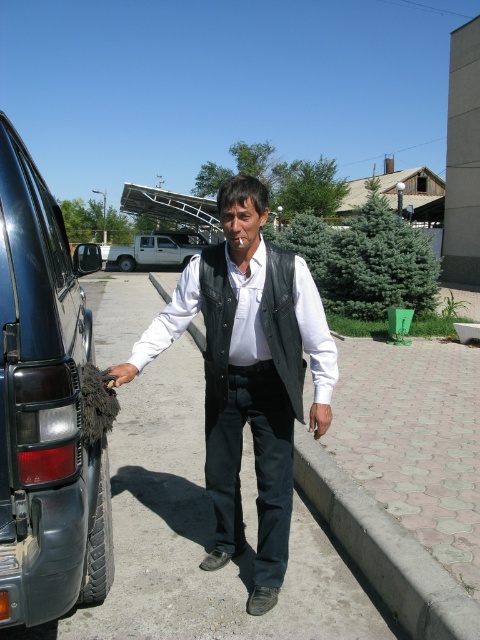
Question: Does leather vest at center have a larger size compared to white matte pickup truck at center?

Choices:
 (A) yes
 (B) no

Answer: (B)

Question: Estimate the real-world distances between objects in this image. Which object is closer to the dark gray rubber tire at left?

Choices:
 (A) white matte pickup truck at center
 (B) leather vest at center
 (C) black leather vest at center
 (D) concrete at center

Answer: (C)

Question: Which object is farther from the camera taking this photo?

Choices:
 (A) concrete at center
 (B) leather vest at center
 (C) black leather vest at center

Answer: (B)

Question: Is concrete at center thinner than white matte pickup truck at center?

Choices:
 (A) yes
 (B) no

Answer: (A)

Question: Which of the following is the closest to the observer?

Choices:
 (A) leather vest at center
 (B) black leather vest at center
 (C) white matte pickup truck at center
 (D) concrete at center

Answer: (D)

Question: Does leather vest at center have a greater width compared to white matte pickup truck at center?

Choices:
 (A) no
 (B) yes

Answer: (A)